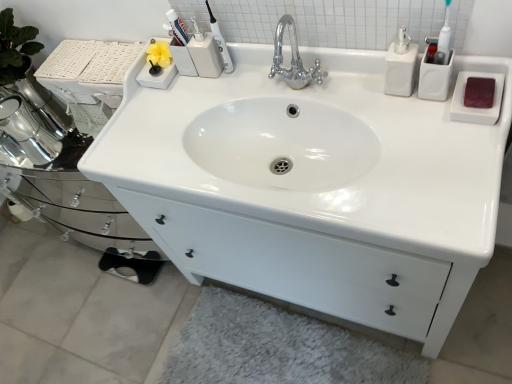
Locate an element on the screen. This screenshot has width=512, height=384. vacant area on top of white fluffy bath mat at lower center (from a real-world perspective) is located at coordinates (270, 349).